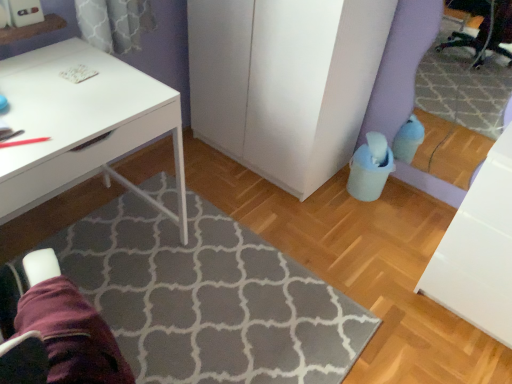
Question: Is white matte desk at upper left bigger than purple fabric swivel chair at lower left?

Choices:
 (A) no
 (B) yes

Answer: (B)

Question: Does white matte desk at upper left have a greater width compared to purple fabric swivel chair at lower left?

Choices:
 (A) no
 (B) yes

Answer: (B)

Question: Considering the relative positions of white matte desk at upper left and purple fabric swivel chair at lower left in the image provided, is white matte desk at upper left to the left of purple fabric swivel chair at lower left from the viewer's perspective?

Choices:
 (A) no
 (B) yes

Answer: (B)

Question: Is the position of white matte desk at upper left more distant than that of purple fabric swivel chair at lower left?

Choices:
 (A) yes
 (B) no

Answer: (A)

Question: Is white matte desk at upper left oriented away from purple fabric swivel chair at lower left?

Choices:
 (A) no
 (B) yes

Answer: (A)

Question: Is white matte desk at upper left positioned before purple fabric swivel chair at lower left?

Choices:
 (A) yes
 (B) no

Answer: (B)

Question: Can you confirm if white glossy file cabinet at lower right is wider than white matte cabinet at center?

Choices:
 (A) yes
 (B) no

Answer: (B)

Question: From a real-world perspective, does white glossy file cabinet at lower right sit lower than white matte cabinet at center?

Choices:
 (A) yes
 (B) no

Answer: (A)

Question: Is white glossy file cabinet at lower right closer to camera compared to white matte cabinet at center?

Choices:
 (A) yes
 (B) no

Answer: (A)

Question: Considering the relative sizes of white glossy file cabinet at lower right and white matte cabinet at center in the image provided, is white glossy file cabinet at lower right bigger than white matte cabinet at center?

Choices:
 (A) yes
 (B) no

Answer: (B)

Question: Can you confirm if white glossy file cabinet at lower right is positioned to the left of white matte cabinet at center?

Choices:
 (A) yes
 (B) no

Answer: (B)

Question: Is white glossy file cabinet at lower right positioned with its back to white matte cabinet at center?

Choices:
 (A) yes
 (B) no

Answer: (B)

Question: Can you confirm if white matte desk at upper left is wider than gray textured rug at center?

Choices:
 (A) no
 (B) yes

Answer: (A)